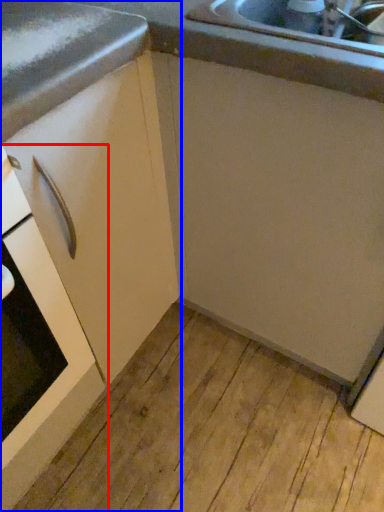
Question: Which object is closer to the camera taking this photo, home appliance (highlighted by a red box) or cabinetry (highlighted by a blue box)?

Choices:
 (A) home appliance
 (B) cabinetry

Answer: (A)